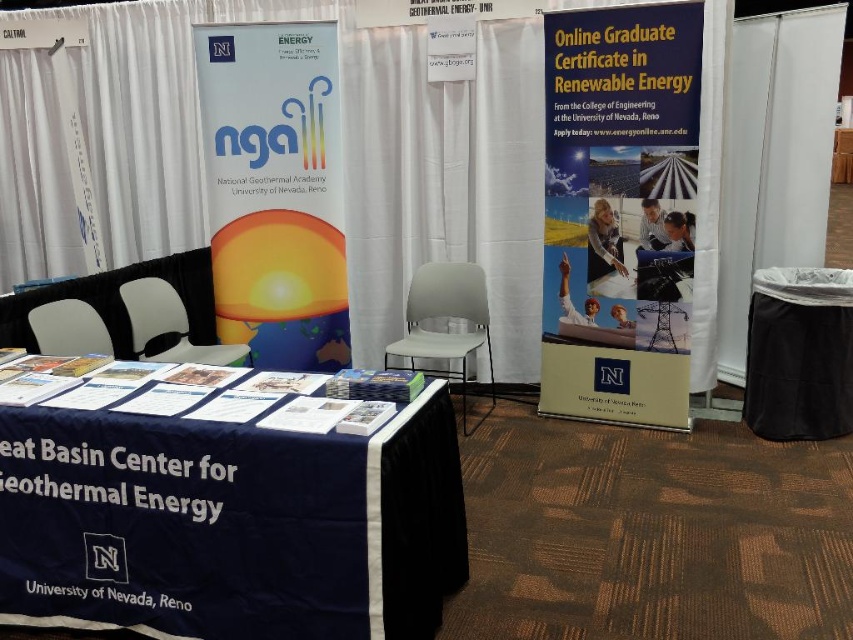
Question: Which point appears closest to the camera in this image?

Choices:
 (A) (283, 292)
 (B) (82, 570)

Answer: (B)

Question: From the image, what is the correct spatial relationship of blue fabric table at lower left in relation to yellow matte sign at center?

Choices:
 (A) right
 (B) left

Answer: (A)

Question: Where is blue fabric table at lower left located in relation to yellow matte sign at center in the image?

Choices:
 (A) left
 (B) right

Answer: (B)

Question: From the image, what is the correct spatial relationship of blue fabric table at lower left in relation to yellow matte sign at center?

Choices:
 (A) right
 (B) left

Answer: (A)